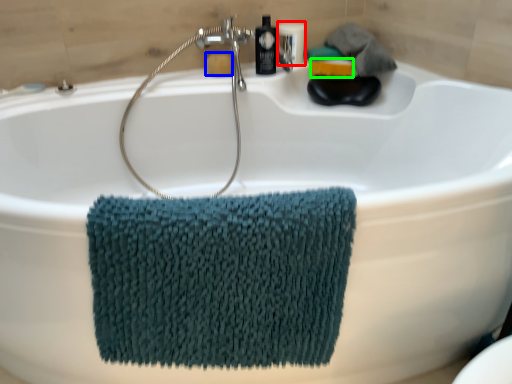
Question: Estimate the real-world distances between objects in this image. Which object is closer to toiletry (highlighted by a red box), soap (highlighted by a blue box) or soap (highlighted by a green box)?

Choices:
 (A) soap
 (B) soap

Answer: (B)